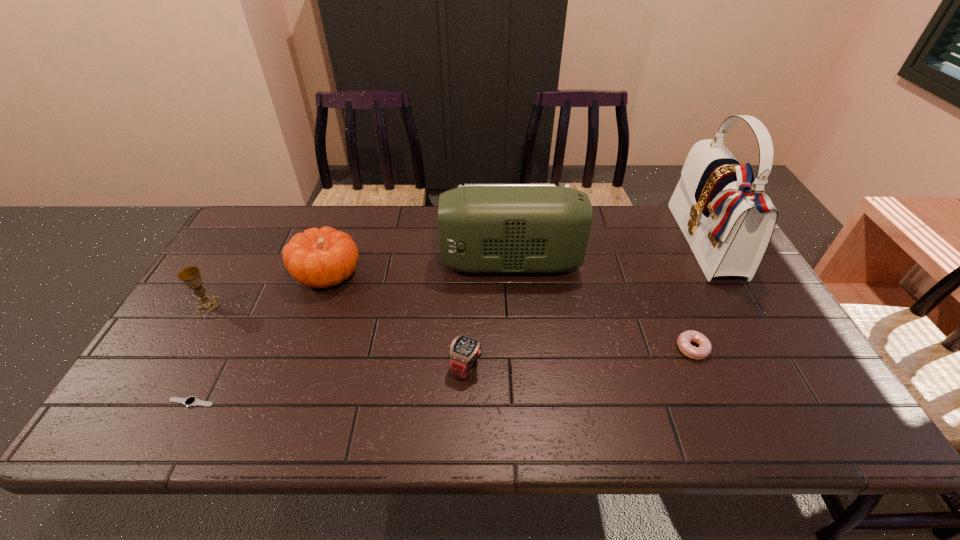
Locate an element on the screen. Image resolution: width=960 pixels, height=540 pixels. the left watch is located at coordinates (192, 400).

Image resolution: width=960 pixels, height=540 pixels. I want to click on vacant space situated on the front-facing side of the rightmost object, so click(664, 244).

This screenshot has height=540, width=960. Identify the location of free point located on the front-facing side of the rightmost object. (655, 244).

Where is `free space located on the front-facing side of the rightmost object`? This screenshot has height=540, width=960. free space located on the front-facing side of the rightmost object is located at coordinates (633, 244).

At what (x,y) coordinates should I click in order to perform the action: click on free space located 0.240m on the front-facing side of the second tallest object. Please return your answer as a coordinate pair (x, y). Image resolution: width=960 pixels, height=540 pixels. Looking at the image, I should click on (365, 263).

Find the location of a particular element. Image resolution: width=960 pixels, height=540 pixels. vacant space situated 0.230m on the front-facing side of the second tallest object is located at coordinates (368, 263).

Identify the location of free region located 0.320m on the front-facing side of the second tallest object. (338, 263).

Identify the location of free space located 0.200m on the left of the fifth object from right to left. (226, 274).

The image size is (960, 540). I want to click on free space located on the right of the leftmost object, so click(263, 305).

Identify the location of vacant region located 0.140m on the left of the farther watch. The width and height of the screenshot is (960, 540). (394, 366).